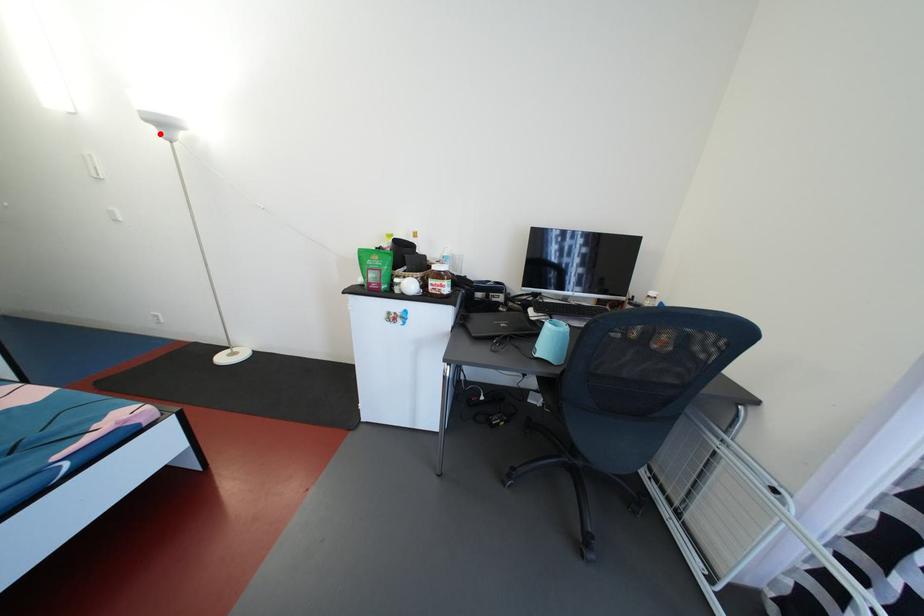
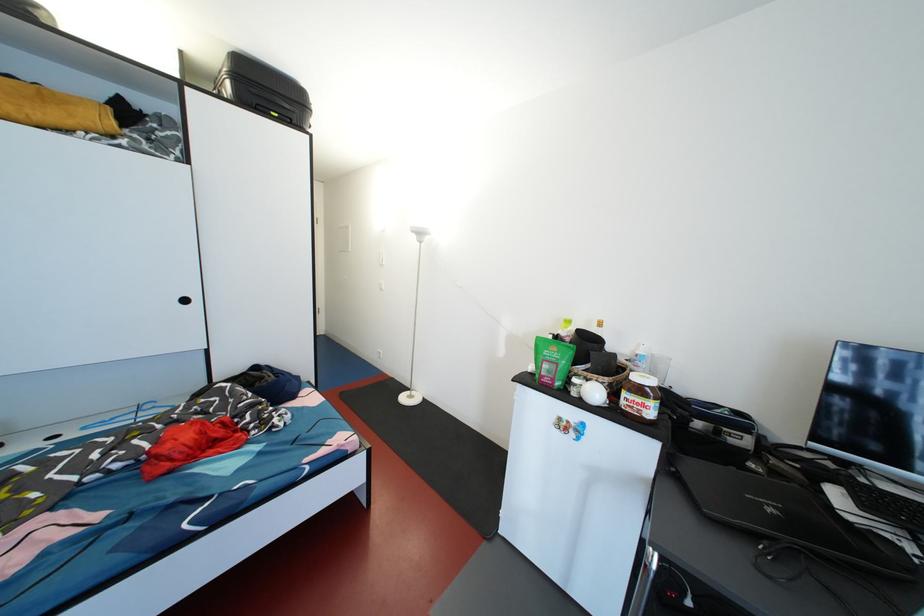
In the second image, find the point that corresponds to the highlighted location in the first image.

(420, 241)